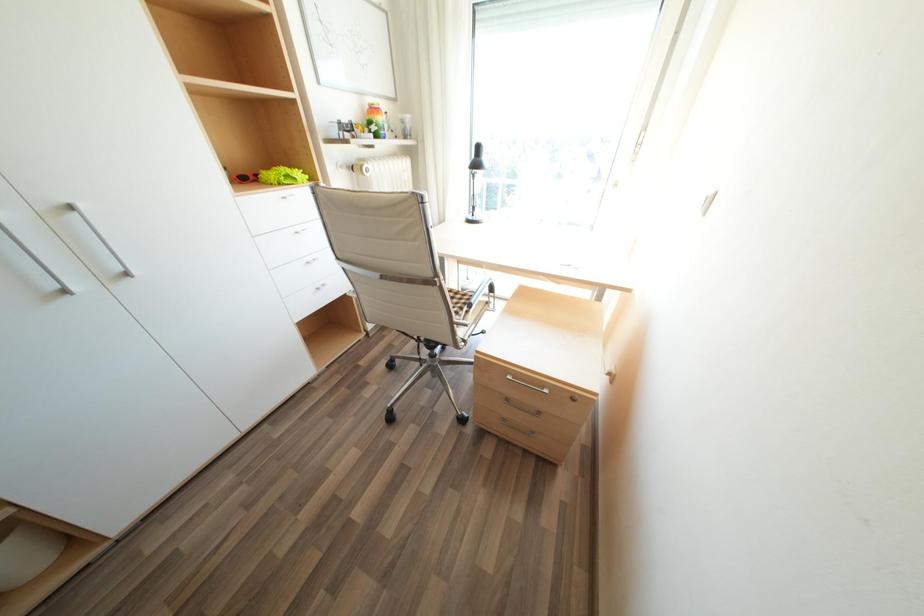
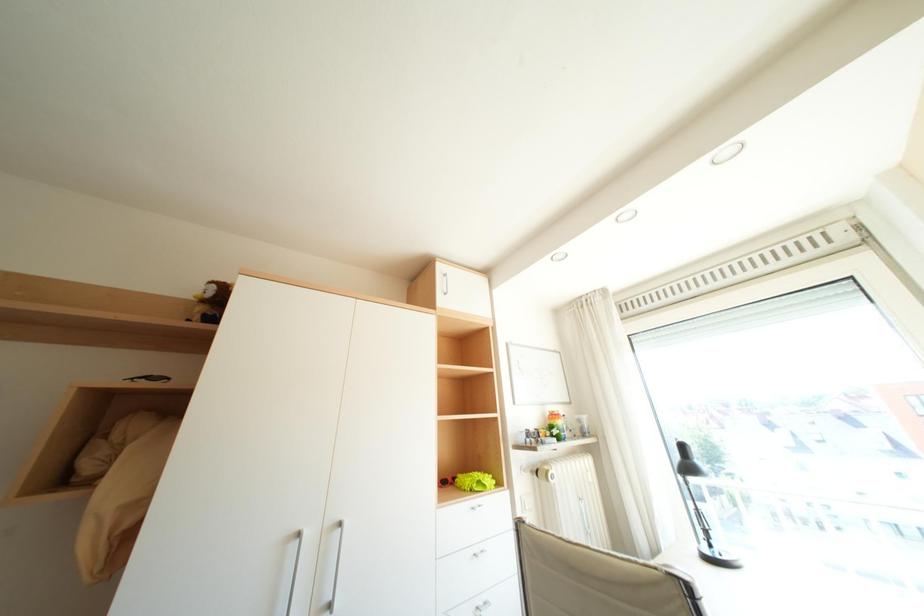
First-person continuous shooting, in which direction is the camera rotating?

The rotation direction of the camera is left-up.